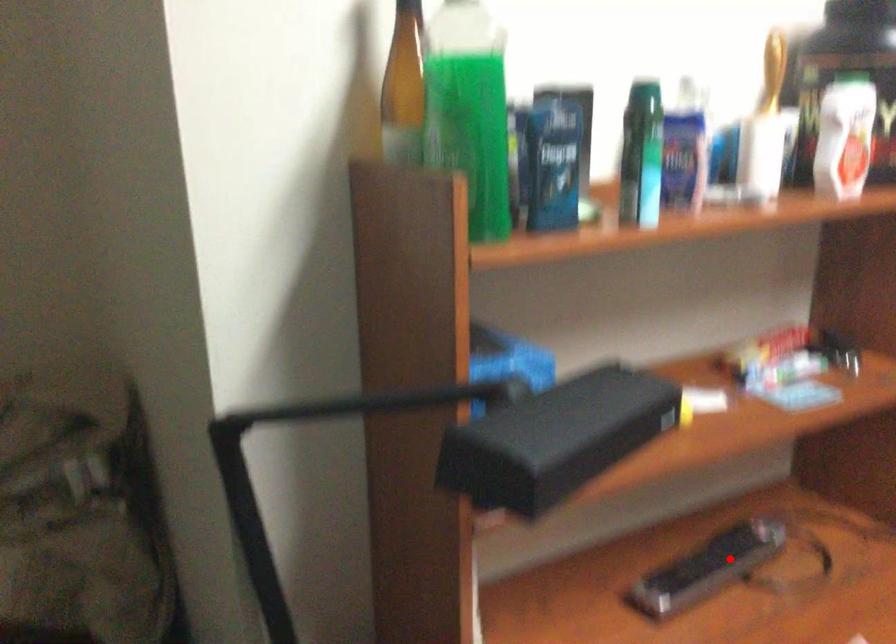
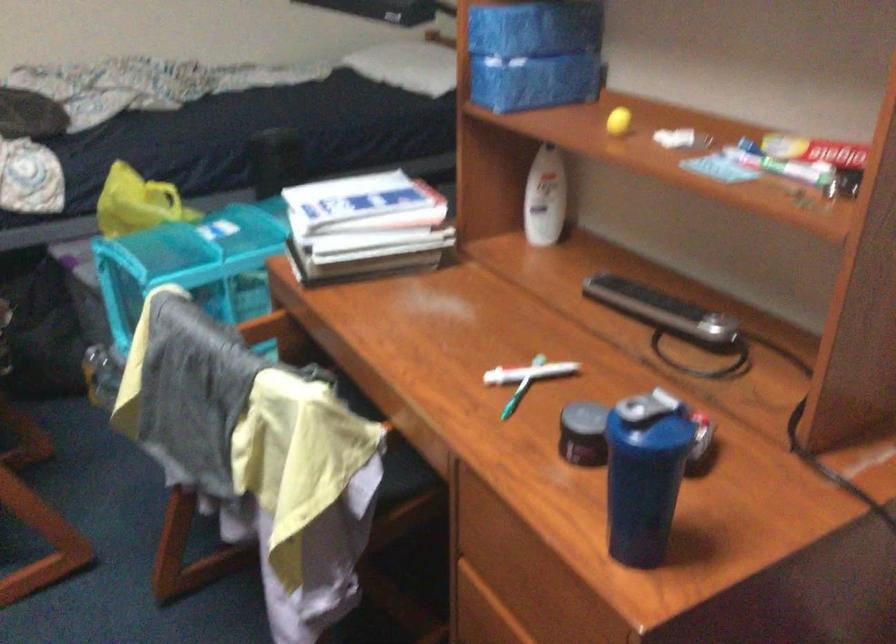
Locate, in the second image, the point that corresponds to the highlighted location in the first image.

(661, 308)